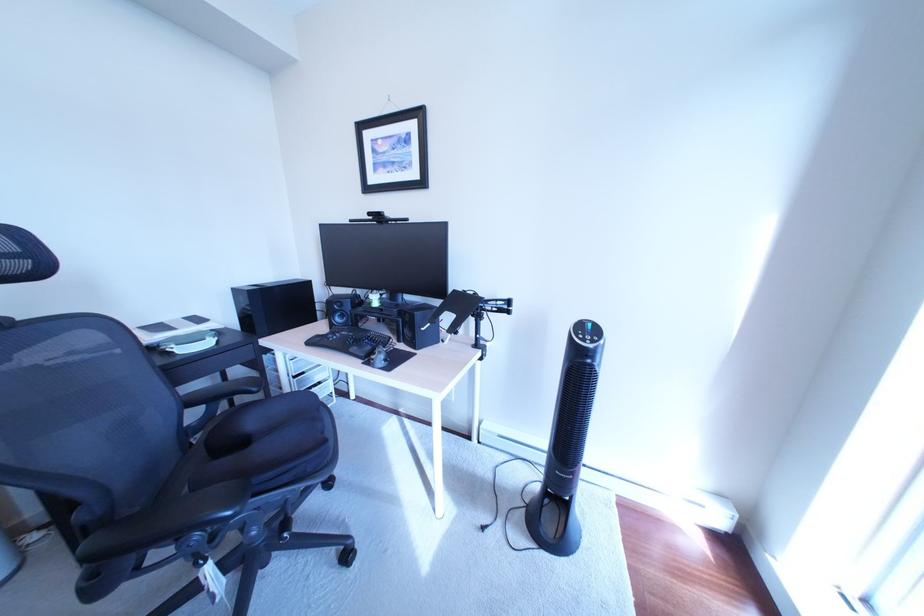
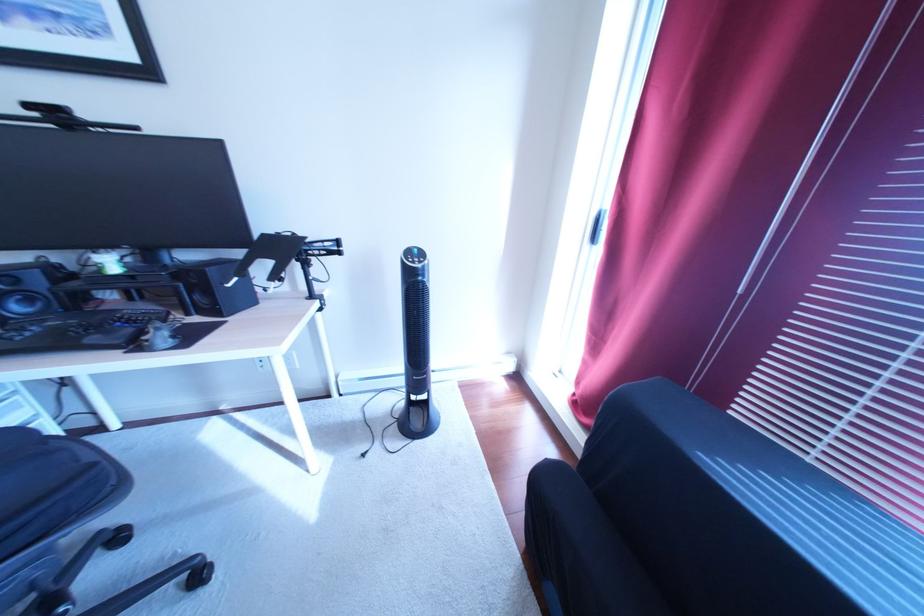
Question: The camera is either moving clockwise (left) or counter-clockwise (right) around the object. The first image is from the beginning of the video and the second image is from the end. Is the camera moving left or right when shooting the video?

Choices:
 (A) Left
 (B) Right

Answer: (A)